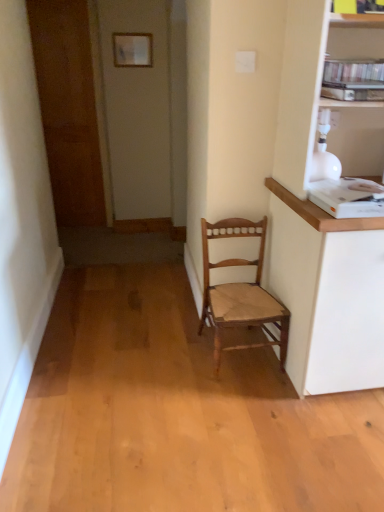
Measure the distance between white plastic printer at upper right and camera.

white plastic printer at upper right is 4.78 feet from camera.

I want to click on white paper at upper center, so click(132, 49).

Describe the element at coordinates (71, 106) in the screenshot. I see `brown wooden door at left` at that location.

Locate an element on the screen. The height and width of the screenshot is (512, 384). wooden chair at center is located at coordinates (240, 292).

What is the approximate width of wooden chair at center?

The width of wooden chair at center is 15.68 inches.

What are the coordinates of `white plastic printer at upper right` in the screenshot? It's located at (348, 197).

Relative to wooden chair at center, is white plastic printer at upper right in front or behind?

Visually, white plastic printer at upper right is located in front of wooden chair at center.

From the image's perspective, does white plastic printer at upper right appear higher than wooden chair at center?

Yes, from the image's perspective, white plastic printer at upper right is on top of wooden chair at center.

Which point is more forward, (373,183) or (211,323)?

The point (373,183) is closer.

Can you see white plastic printer at upper right touching wooden chair at center?

white plastic printer at upper right is not next to wooden chair at center, and they're not touching.

Is brown wooden door at left smaller than white paper at upper center?

No, brown wooden door at left is not smaller than white paper at upper center.

Which point is more forward, (103, 193) or (137, 53)?

The point (137, 53) is in front.

From the picture: Does brown wooden door at left contain white paper at upper center?

No, white paper at upper center is located outside of brown wooden door at left.

Considering the points (146, 40) and (98, 163), which point is behind, point (146, 40) or point (98, 163)?

The point (98, 163) is farther from the camera.

From the image's perspective, is white paper at upper center located above or below brown wooden door at left?

Based on their image positions, white paper at upper center is located above brown wooden door at left.

Consider the image. Can you confirm if white paper at upper center is smaller than brown wooden door at left?

Yes.

Which is more to the left, white paper at upper center or brown wooden door at left?

Positioned to the left is brown wooden door at left.

In the scene shown: Could you tell me if white paper at upper center is facing white plastic printer at upper right?

Yes, white paper at upper center faces towards white plastic printer at upper right.

From their relative heights in the image, would you say white paper at upper center is taller or shorter than white plastic printer at upper right?

In the image, white paper at upper center appears to be taller than white plastic printer at upper right.

Is point (148, 33) farther from viewer compared to point (331, 214)?

Yes.

Is white paper at upper center to the left or to the right of white plastic printer at upper right in the image?

white paper at upper center is to the left of white plastic printer at upper right.

Is white plastic printer at upper right positioned before brown wooden door at left?

Yes, white plastic printer at upper right is closer to the camera.

Locate an element on the screen. The width and height of the screenshot is (384, 512). appliance lying on the right of brown wooden door at left is located at coordinates (348, 197).

How many degrees apart are the facing directions of white plastic printer at upper right and brown wooden door at left?

white plastic printer at upper right and brown wooden door at left are facing 0.346 degrees away from each other.

Does point (217, 343) come in front of point (91, 74)?

Yes, point (217, 343) is closer to viewer.

The width and height of the screenshot is (384, 512). In order to click on chair on the right of brown wooden door at left in this screenshot , I will do `click(240, 292)`.

Considering the sizes of wooden chair at center and brown wooden door at left in the image, is wooden chair at center taller or shorter than brown wooden door at left?

In the image, wooden chair at center appears to be shorter than brown wooden door at left.

Is brown wooden door at left surrounded by wooden chair at center?

Actually, brown wooden door at left is outside wooden chair at center.

Is brown wooden door at left wider or thinner than wooden chair at center?

In the image, brown wooden door at left appears to be more narrow than wooden chair at center.

Which is closer to the camera, [87,111] or [253,225]?

Point [87,111] is positioned farther from the camera compared to point [253,225].

Is brown wooden door at left behind wooden chair at center?

Yes, brown wooden door at left is behind wooden chair at center.

In terms of height, does brown wooden door at left look taller or shorter compared to wooden chair at center?

In the image, brown wooden door at left appears to be taller than wooden chair at center.

In order to click on appliance that appears on the right of wooden chair at center in this screenshot , I will do `click(348, 197)`.

Where is `door beneath the white paper at upper center (from a real-world perspective)`? The width and height of the screenshot is (384, 512). door beneath the white paper at upper center (from a real-world perspective) is located at coordinates (71, 106).

From the image, which object appears to be farther from white paper at upper center, wooden chair at center or white plastic printer at upper right?

Among the two, white plastic printer at upper right is located further to white paper at upper center.

Considering their positions, is white paper at upper center positioned further to brown wooden door at left than white plastic printer at upper right?

white plastic printer at upper right is positioned further to the anchor brown wooden door at left.

When comparing their distances from white paper at upper center, does brown wooden door at left or wooden chair at center seem closer?

The object closer to white paper at upper center is brown wooden door at left.

Looking at the image, which one is located closer to white plastic printer at upper right, wooden chair at center or white paper at upper center?

wooden chair at center is closer to white plastic printer at upper right.

Looking at the image, which one is located further to wooden chair at center, white plastic printer at upper right or brown wooden door at left?

brown wooden door at left.

From the image, which object appears to be farther from brown wooden door at left, wooden chair at center or white paper at upper center?

wooden chair at center is further to brown wooden door at left.

From the image, which object appears to be nearer to white plastic printer at upper right, white paper at upper center or brown wooden door at left?

white paper at upper center lies closer to white plastic printer at upper right than the other object.

From the image, which object appears to be farther from wooden chair at center, brown wooden door at left or white paper at upper center?

brown wooden door at left.

Locate an element on the screen. This screenshot has width=384, height=512. chair positioned between white plastic printer at upper right and brown wooden door at left from near to far is located at coordinates [x=240, y=292].

Identify the location of door between wooden chair at center and white paper at upper center from front to back. This screenshot has width=384, height=512. (71, 106).

The height and width of the screenshot is (512, 384). Find the location of `door positioned between white plastic printer at upper right and white paper at upper center from near to far`. door positioned between white plastic printer at upper right and white paper at upper center from near to far is located at coordinates (71, 106).

This screenshot has height=512, width=384. Identify the location of chair located between white plastic printer at upper right and white paper at upper center in the depth direction. (240, 292).